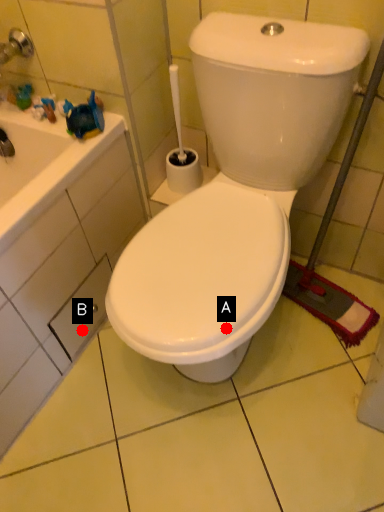
Question: Two points are circled on the image, labeled by A and B beside each circle. Which point is farther to the camera?

Choices:
 (A) A is further
 (B) B is further

Answer: (B)